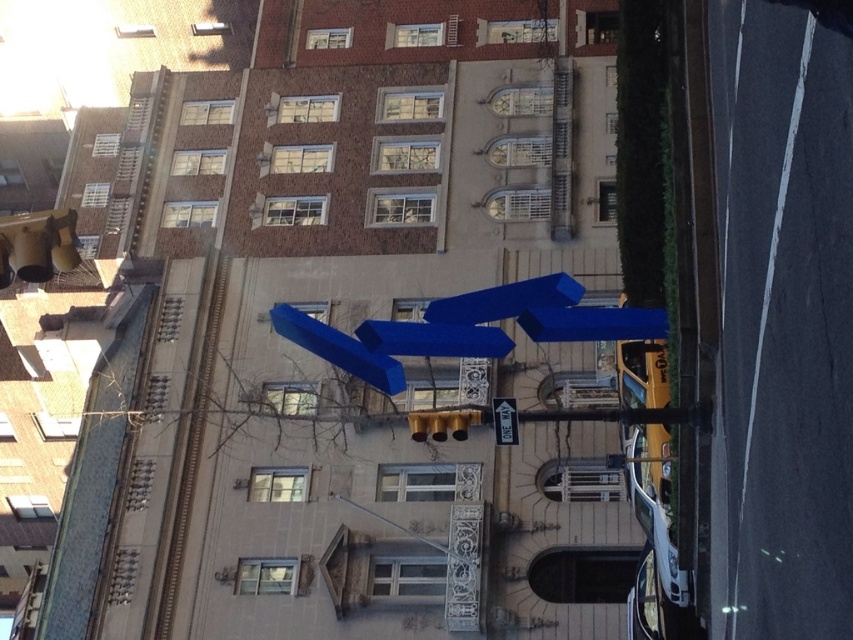
You are a delivery driver who needs to navigate through the street. You see the blue matte sculpture at center and the white plastic one way sign at center. Which object is wider?

A: The blue matte sculpture at center is wider than the white plastic one way sign at center.

You are a pedestrian approaching the blue matte sculpture at center and the white plastic one way sign at center. Which object will you encounter first as you walk towards them?

The blue matte sculpture at center is closer to you than the white plastic one way sign at center, so you will encounter the blue matte sculpture at center first.

You are a pedestrian standing at the intersection and see both the blue glossy arrow at center and the white plastic one way sign at center. Which direction should you look first to follow the traffic rules?

You should look at the white plastic one way sign at center first because the blue glossy arrow at center is to the left of it, indicating the arrow is on the left side, so the one way sign is on the right which typically indicates direction you should follow.